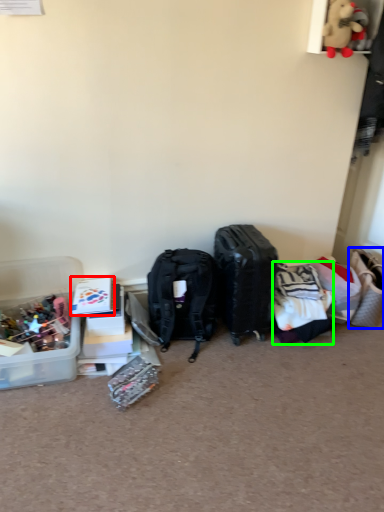
Question: Which is farther away from storage box (highlighted by a red box)? handbag (highlighted by a blue box) or clothing (highlighted by a green box)?

Choices:
 (A) handbag
 (B) clothing

Answer: (A)